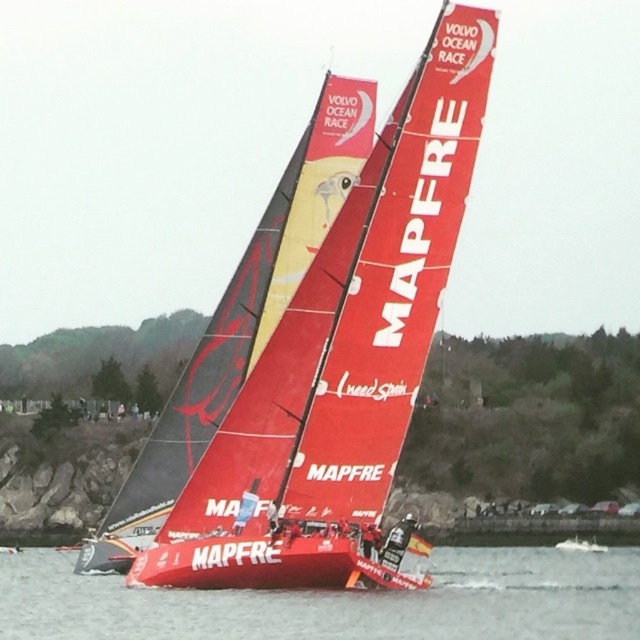
Is point (243, 595) in front of point (232, 369)?

Yes, point (243, 595) is in front of point (232, 369).

Can you confirm if red plastic water at lower center is bigger than red matte sailboat at center?

Yes, red plastic water at lower center is bigger than red matte sailboat at center.

Between point (492, 557) and point (182, 392), which one is positioned behind?

Point (492, 557)

Find the location of a particular element. This screenshot has height=640, width=640. red plastic water at lower center is located at coordinates (339, 602).